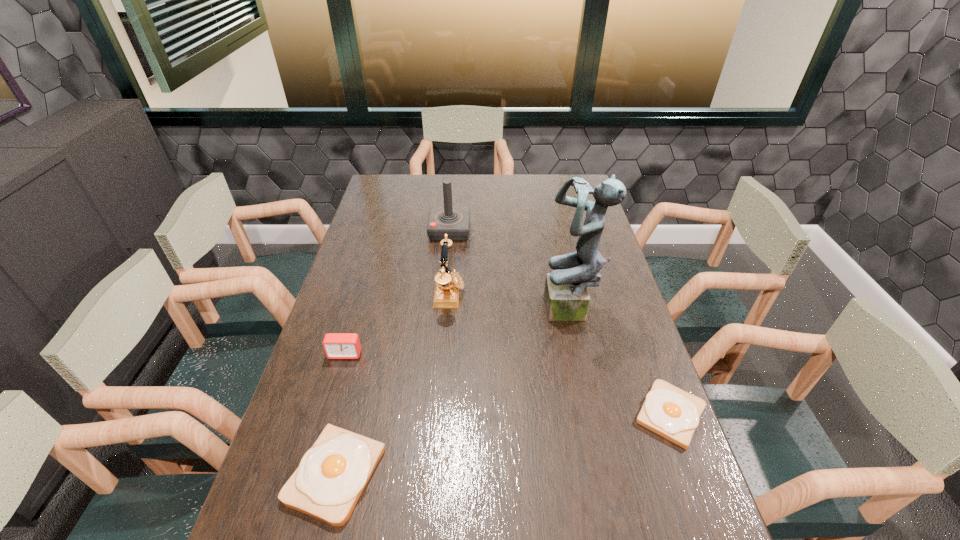
Where is `vacant position for inserting another toast_(food) evenly`? vacant position for inserting another toast_(food) evenly is located at coordinates (512, 442).